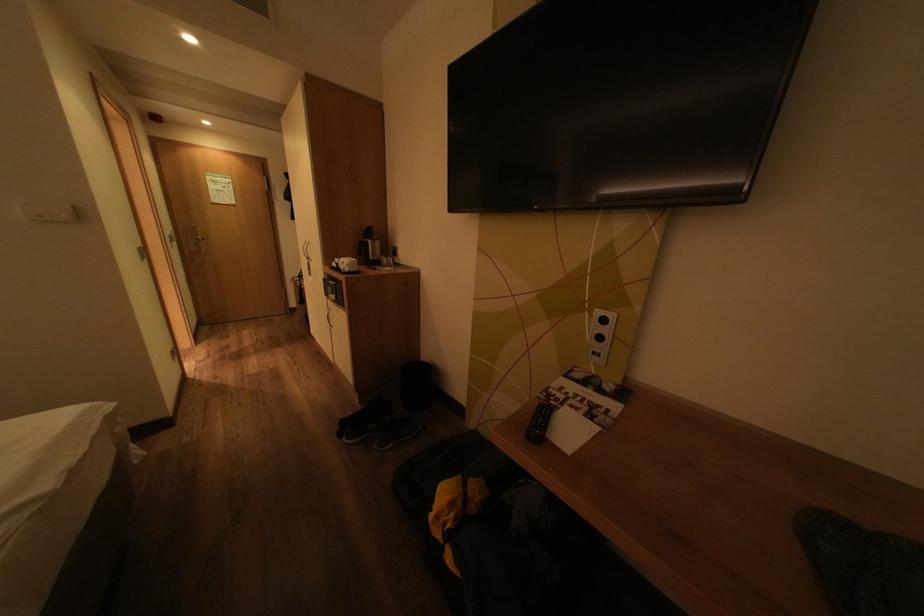
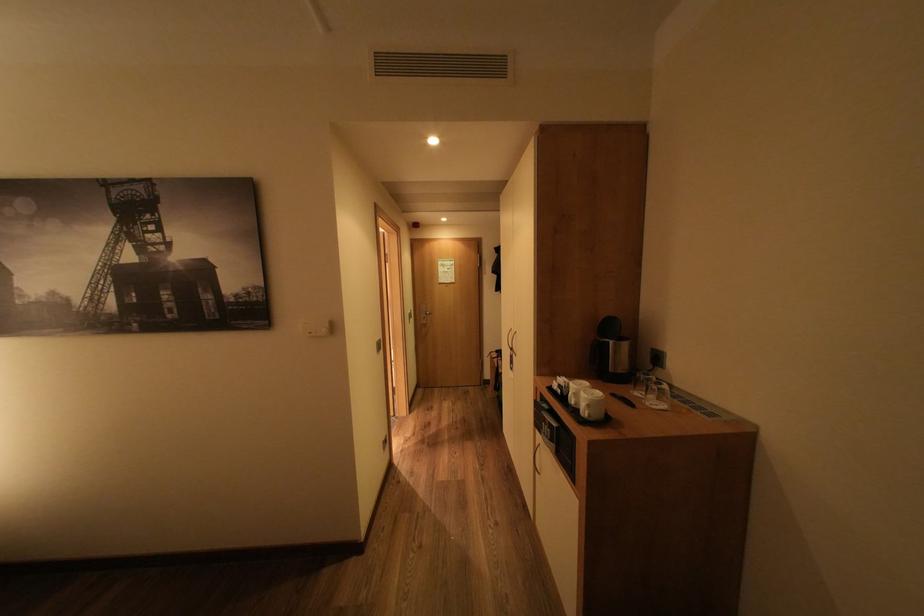
In the second image, find the point that corresponds to point (180, 237) in the first image.

(419, 315)